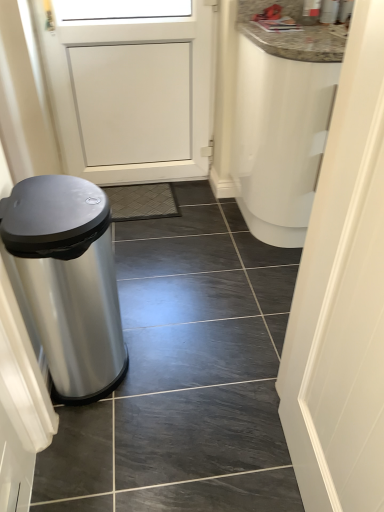
Locate an element on the screen. vacant space behind polished stainless steel trash can at left is located at coordinates (143, 312).